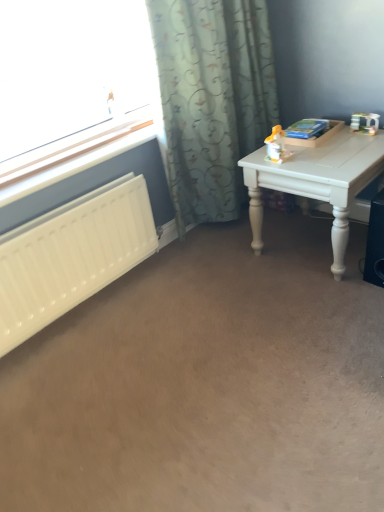
At what (x,y) coordinates should I click in order to perform the action: click on free space between black plastic speaker at lower right and white matte radiator at left. Please return your answer as a coordinate pair (x, y). This screenshot has height=512, width=384. Looking at the image, I should click on (208, 295).